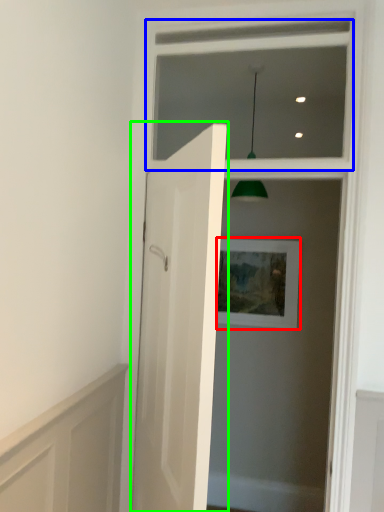
Question: Which object is the farthest from picture frame (highlighted by a red box)? Choose among these: window frame (highlighted by a blue box) or door (highlighted by a green box).

Choices:
 (A) window frame
 (B) door

Answer: (B)